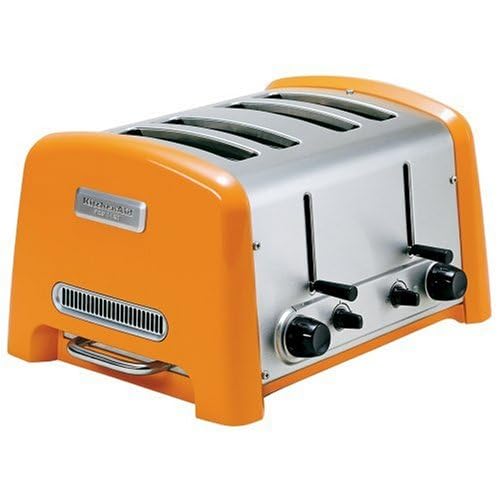
I want to click on knob2, so click(427, 287).